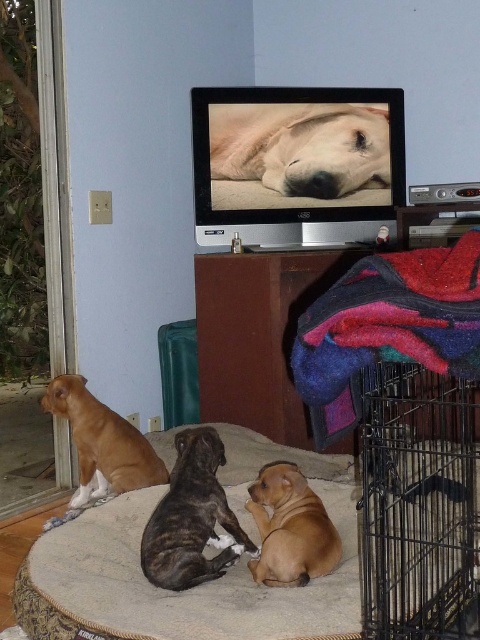
You are a pet owner who wants to place a new toy between the carpeted pet bed at lower center and the black wire cage at lower right. Considering their widths, which object will the toy be closer to after placement?

The carpeted pet bed at lower center is wider than the black wire cage at lower right. Since the toy is placed between them, it will be closer to the narrower black wire cage at lower right.